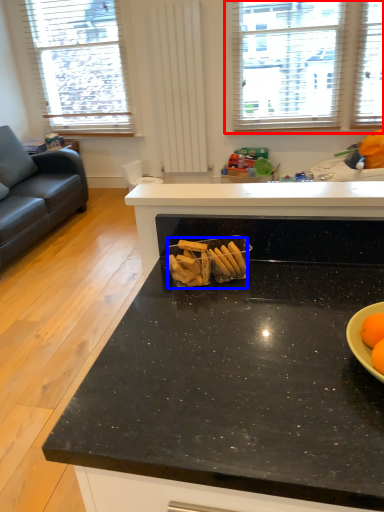
Question: Which of the following is the closest to the observer, window (highlighted by a red box) or snack (highlighted by a blue box)?

Choices:
 (A) window
 (B) snack

Answer: (B)